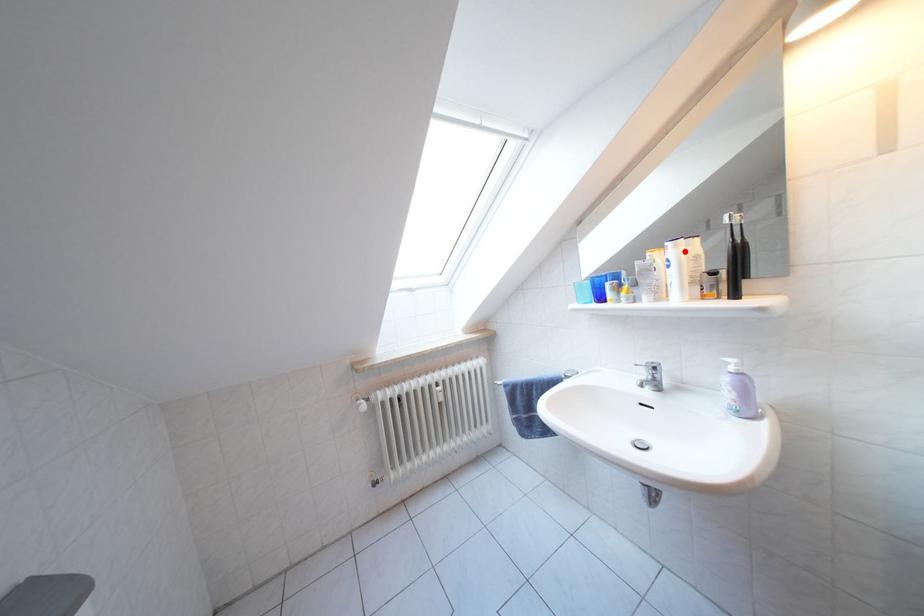
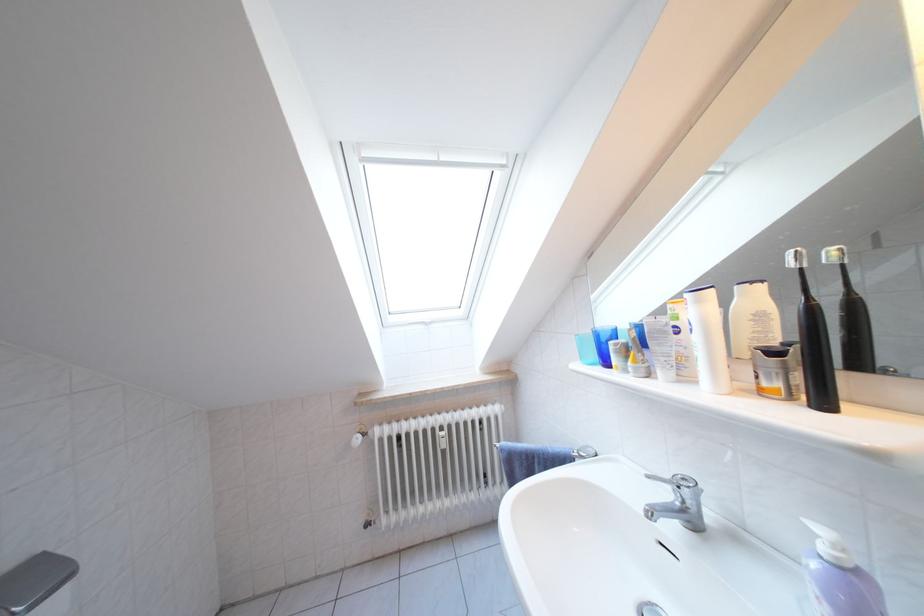
Question: I am providing you with two images of the same scene from different viewpoints. A red point is marked on the first image. Is the red point's position out of view in image 2?

Choices:
 (A) Yes
 (B) No

Answer: (B)